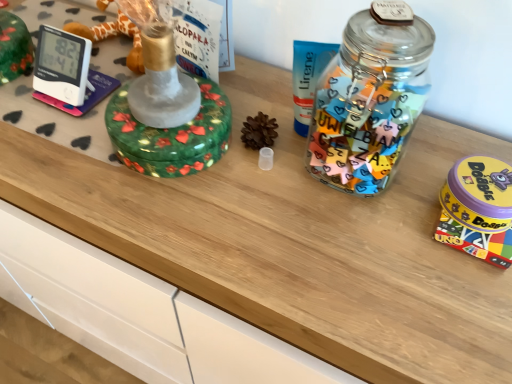
Question: From a real-world perspective, is yellow plastic game at right, the 2th toy when ordered from left to right, physically below transparent plastic pinecone at center, marked as the 1th toy in a left-to-right arrangement?

Choices:
 (A) yes
 (B) no

Answer: (B)

Question: From the image's perspective, is yellow plastic game at right, the 1th toy when ordered from right to left, over transparent plastic pinecone at center, marked as the 1th toy in a left-to-right arrangement?

Choices:
 (A) no
 (B) yes

Answer: (A)

Question: Could you tell me if yellow plastic game at right, the 2th toy when ordered from left to right, is facing transparent plastic pinecone at center, arranged as the second toy when viewed from the right?

Choices:
 (A) no
 (B) yes

Answer: (A)

Question: Is yellow plastic game at right, the 1th toy when ordered from right to left, positioned before transparent plastic pinecone at center, marked as the 1th toy in a left-to-right arrangement?

Choices:
 (A) yes
 (B) no

Answer: (A)

Question: Is yellow plastic game at right, the 2th toy when ordered from left to right, outside transparent plastic pinecone at center, marked as the 1th toy in a left-to-right arrangement?

Choices:
 (A) no
 (B) yes

Answer: (B)

Question: Is yellow plastic game at right, the 2th toy when ordered from left to right, bigger than transparent plastic pinecone at center, marked as the 1th toy in a left-to-right arrangement?

Choices:
 (A) no
 (B) yes

Answer: (B)

Question: Is transparent plastic pinecone at center, marked as the 1th toy in a left-to-right arrangement, next to yellow plastic game at right, the 1th toy when ordered from right to left?

Choices:
 (A) no
 (B) yes

Answer: (A)

Question: Is the depth of transparent plastic pinecone at center, arranged as the second toy when viewed from the right, less than that of yellow plastic game at right, the 1th toy when ordered from right to left?

Choices:
 (A) no
 (B) yes

Answer: (A)

Question: Does transparent plastic pinecone at center, marked as the 1th toy in a left-to-right arrangement, have a lesser width compared to yellow plastic game at right, the 2th toy when ordered from left to right?

Choices:
 (A) no
 (B) yes

Answer: (B)

Question: Can you confirm if transparent plastic pinecone at center, marked as the 1th toy in a left-to-right arrangement, is wider than yellow plastic game at right, the 1th toy when ordered from right to left?

Choices:
 (A) yes
 (B) no

Answer: (B)

Question: Is yellow plastic game at right, the 1th toy when ordered from right to left, surrounded by transparent plastic pinecone at center, arranged as the second toy when viewed from the right?

Choices:
 (A) no
 (B) yes

Answer: (A)

Question: Considering the relative sizes of transparent plastic pinecone at center, marked as the 1th toy in a left-to-right arrangement, and yellow plastic game at right, the 1th toy when ordered from right to left, in the image provided, is transparent plastic pinecone at center, marked as the 1th toy in a left-to-right arrangement, taller than yellow plastic game at right, the 1th toy when ordered from right to left,?

Choices:
 (A) yes
 (B) no

Answer: (A)

Question: Is point (262, 130) closer or farther from the camera than point (458, 185)?

Choices:
 (A) farther
 (B) closer

Answer: (A)